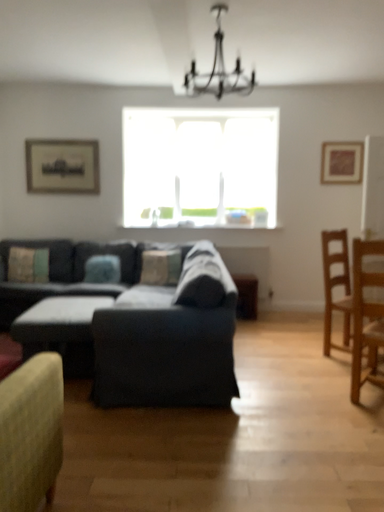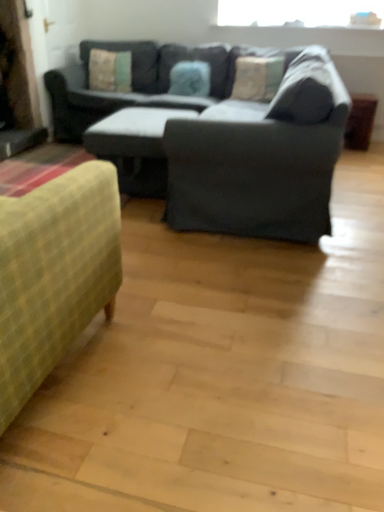
Question: Which way did the camera rotate in the video?

Choices:
 (A) rotated downward
 (B) rotated upward

Answer: (A)